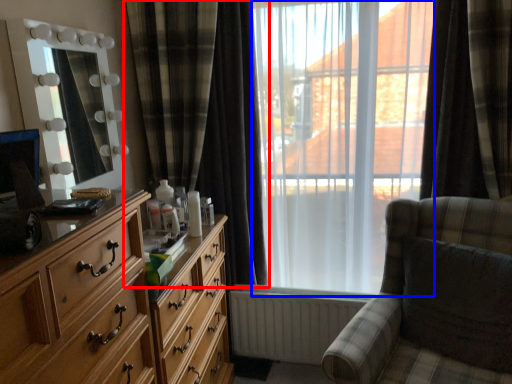
Question: Among these objects, which one is farthest to the camera, curtain (highlighted by a red box) or bay window (highlighted by a blue box)?

Choices:
 (A) curtain
 (B) bay window

Answer: (A)